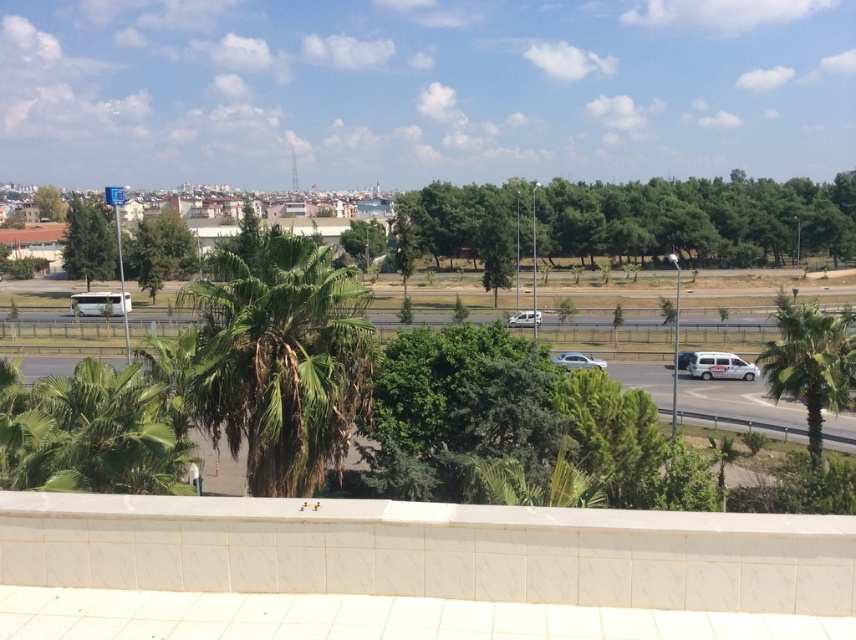
Question: Can you confirm if white matte van at right is positioned above white matte bus at left?

Choices:
 (A) yes
 (B) no

Answer: (B)

Question: Which point is farther to the camera?

Choices:
 (A) (568, 365)
 (B) (64, 268)

Answer: (B)

Question: Where is green leafy palm tree at center located in relation to white metallic van at center in the image?

Choices:
 (A) left
 (B) right

Answer: (A)

Question: Which point is farther from the camera taking this photo?

Choices:
 (A) (447, 214)
 (B) (571, 358)
 (C) (129, 307)

Answer: (A)

Question: Which object is farther from the camera taking this photo?

Choices:
 (A) white metallic van at center
 (B) green leafy tree at left

Answer: (B)

Question: Does green leafy palm tree at center appear under white metallic van at center?

Choices:
 (A) no
 (B) yes

Answer: (B)